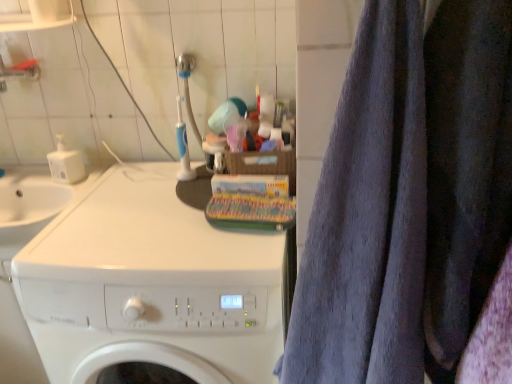
Question: Considering their positions, is dark blue fabric at right located in front of or behind gray terry cloth towel at right?

Choices:
 (A) front
 (B) behind

Answer: (B)

Question: Based on their sizes in the image, would you say dark blue fabric at right is bigger or smaller than gray terry cloth towel at right?

Choices:
 (A) small
 (B) big

Answer: (A)

Question: Estimate the real-world distances between objects in this image. Which object is farther from the white glossy washing machine at center?

Choices:
 (A) gray terry cloth towel at right
 (B) dark blue fabric at right

Answer: (B)

Question: Which is farther from the gray terry cloth towel at right?

Choices:
 (A) dark blue fabric at right
 (B) white glossy washing machine at center

Answer: (B)